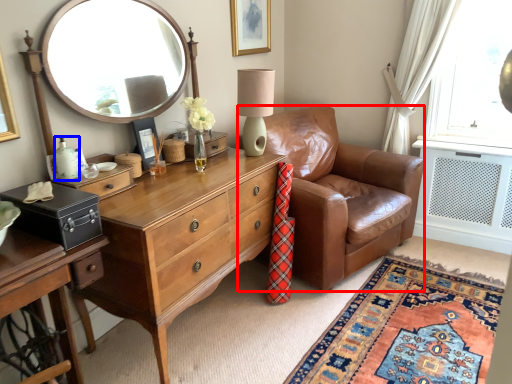
Question: Which object is closer to the camera taking this photo, chair (highlighted by a red box) or bottle (highlighted by a blue box)?

Choices:
 (A) chair
 (B) bottle

Answer: (B)